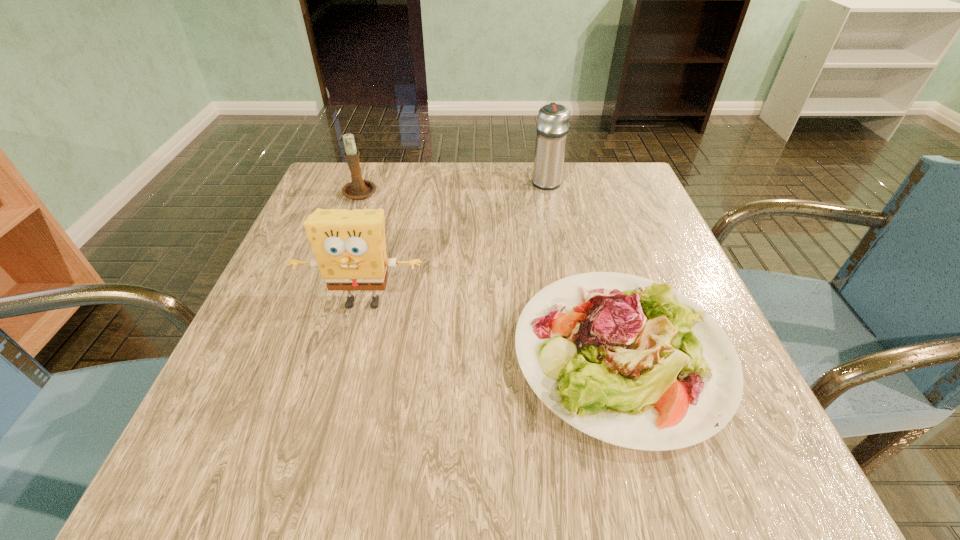
Locate an element on the screen. The height and width of the screenshot is (540, 960). free spot between the sponge and the salad plate is located at coordinates (492, 328).

I want to click on vacant space in between the thermos bottle and the shortest object, so click(x=584, y=267).

Where is `vacant space in between the third tallest object and the salad plate`? This screenshot has width=960, height=540. vacant space in between the third tallest object and the salad plate is located at coordinates (492, 272).

Locate which object is the second closest to the sponge. Please provide its 2D coordinates. Your answer should be formatted as a tuple, i.e. [(x, y)], where the tuple contains the x and y coordinates of a point satisfying the conditions above.

[(357, 189)]

Select which object appears as the closest to the thermos bottle. Please provide its 2D coordinates. Your answer should be formatted as a tuple, i.e. [(x, y)], where the tuple contains the x and y coordinates of a point satisfying the conditions above.

[(632, 362)]

This screenshot has width=960, height=540. In order to click on free space that satisfies the following two spatial constraints: 1. on the face of the salad plate; 2. on the right side of the sponge in this screenshot , I will do `click(349, 353)`.

In order to click on vacant region that satisfies the following two spatial constraints: 1. on the face of the salad plate; 2. on the left side of the sponge in this screenshot , I will do `click(349, 353)`.

This screenshot has height=540, width=960. In order to click on free region that satisfies the following two spatial constraints: 1. on the face of the sponge; 2. on the left side of the shortest object in this screenshot , I will do `click(349, 353)`.

You are a GUI agent. You are given a task and a screenshot of the screen. Output one action in this format:
    pyautogui.click(x=<x>, y=<y>)
    Task: Click on the vacant space that satisfies the following two spatial constraints: 1. on the face of the salad plate; 2. on the left side of the sponge
    
    Given the screenshot: What is the action you would take?
    pyautogui.click(x=349, y=353)